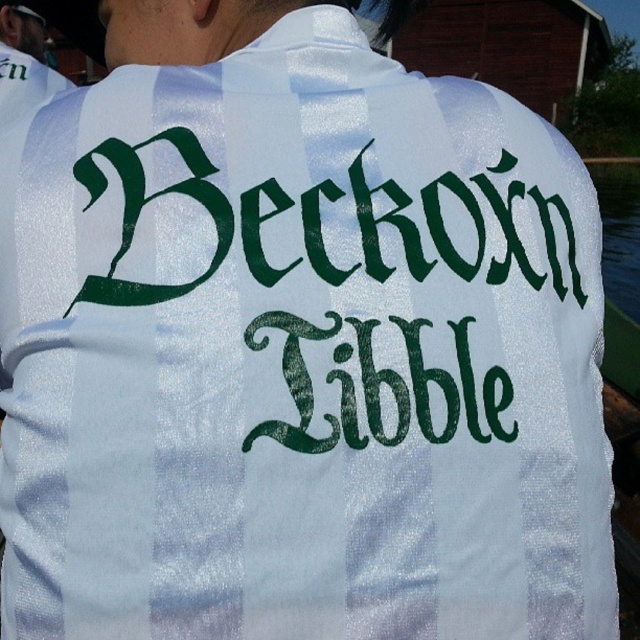
You are standing in front of a person wearing a white shirt with bold green text. You notice two points marked on the shirt. One is at position point (605, 170) and the other at point (22, 86). Which point is closer to you?

Point (605, 170) is further to the viewer than point (22, 86), so the point at point (22, 86) is closer to you.

You are a photographer trying to capture the reflection of the transparent plastic water at right in the white glossy shirt at upper left. Based on their positions, is this possible?

The transparent plastic water at right is above the white glossy shirt at upper left, so its reflection can be seen on the shirt if the angle and lighting are correct.

You are a photographer trying to capture the white glossy shirt at upper left and the transparent plastic water at right in a single frame. Based on their positions, which object do you think will appear larger in the final photo?

The transparent plastic water at right might appear larger in the final photo since it is wider than the white glossy shirt at upper left.